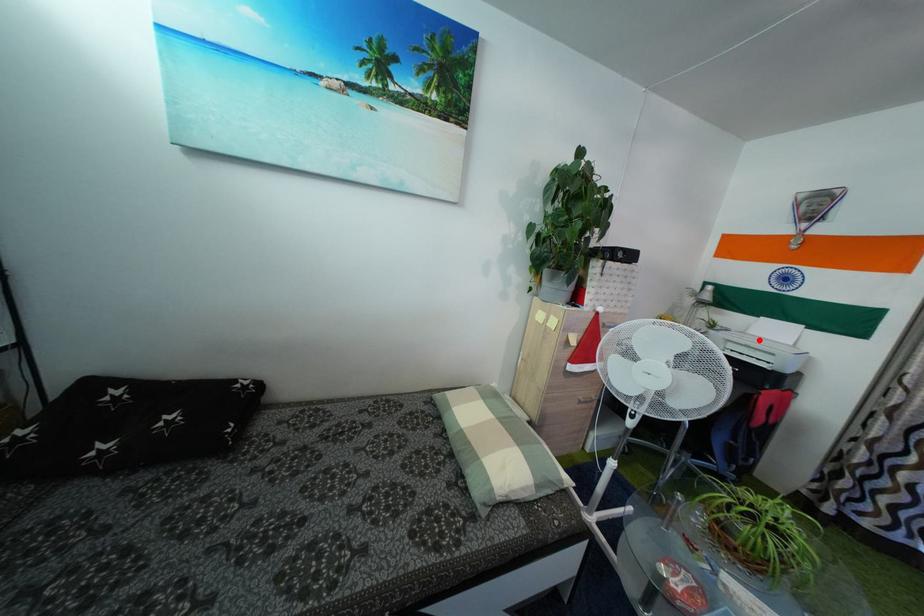
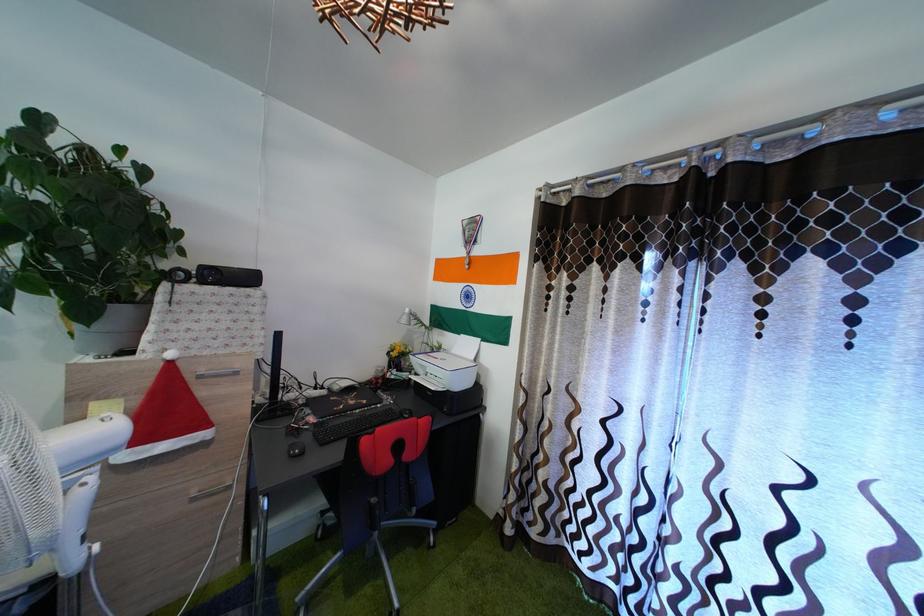
Find the pixel in the second image that matches the highlighted location in the first image.

(462, 359)